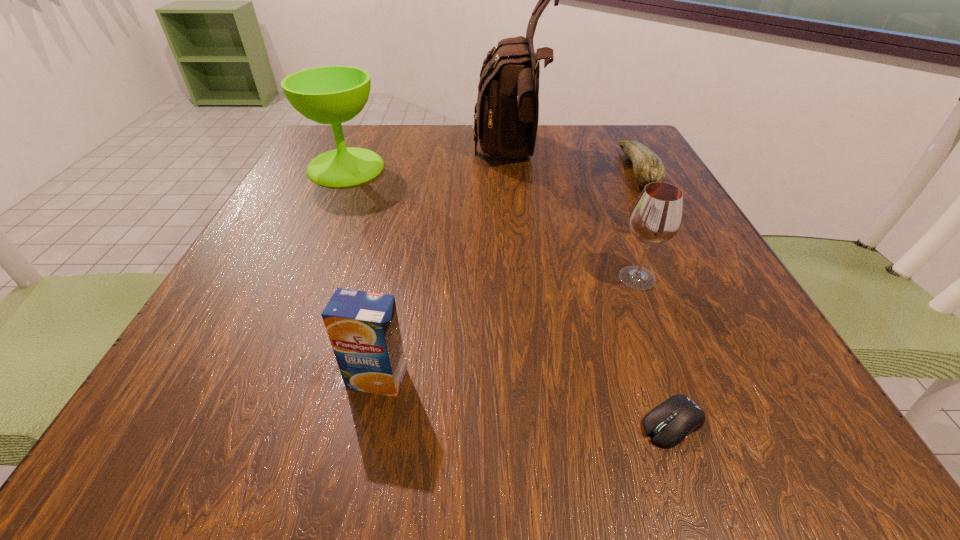
Where is `the tallest object`? The image size is (960, 540). the tallest object is located at coordinates (506, 120).

Where is `shoulder bag`? shoulder bag is located at coordinates (506, 120).

Find the location of `the second tallest object`. the second tallest object is located at coordinates (333, 95).

Where is `the taller wineglass`? the taller wineglass is located at coordinates (333, 95).

Find the location of a particular element. Image resolution: width=960 pixels, height=540 pixels. the third tallest object is located at coordinates (656, 217).

I want to click on the fourth farthest object, so click(656, 217).

Locate an element on the screen. This screenshot has width=960, height=540. the second nearest object is located at coordinates (363, 328).

Identify the location of orange_juice. The width and height of the screenshot is (960, 540). (363, 328).

Identify the location of zucchini. The width and height of the screenshot is (960, 540). (647, 166).

Where is `the rightmost object`? The image size is (960, 540). the rightmost object is located at coordinates (647, 166).